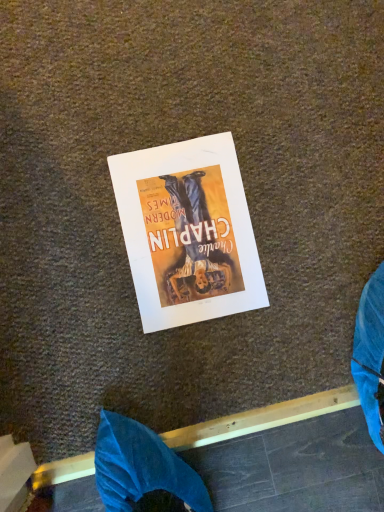
What are the coordinates of `free space above matte paper poster at center (from a real-world perspective)` in the screenshot? It's located at (191, 234).